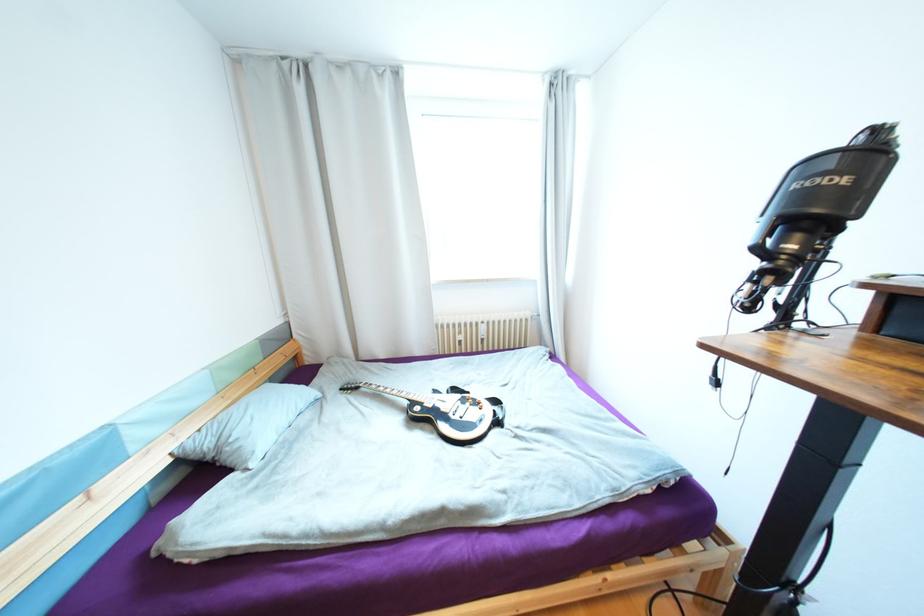
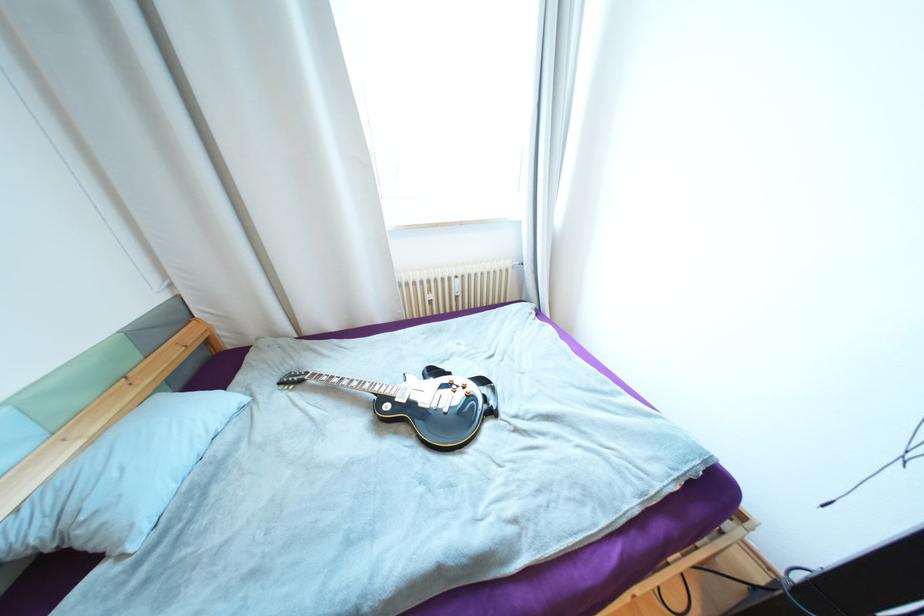
In the second image, find the point that corresponds to pixel 447 410 in the first image.

(426, 405)